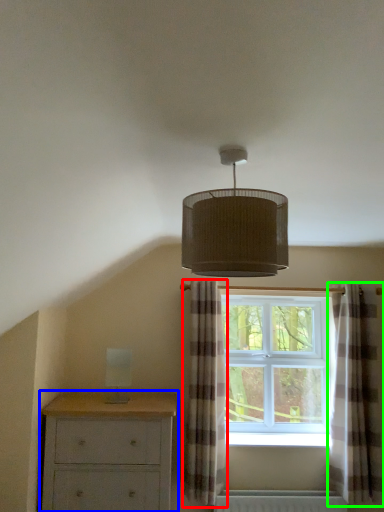
Question: Which object is the farthest from curtain (highlighted by a red box)? Choose among these: chest of drawers (highlighted by a blue box) or curtain (highlighted by a green box).

Choices:
 (A) chest of drawers
 (B) curtain

Answer: (B)